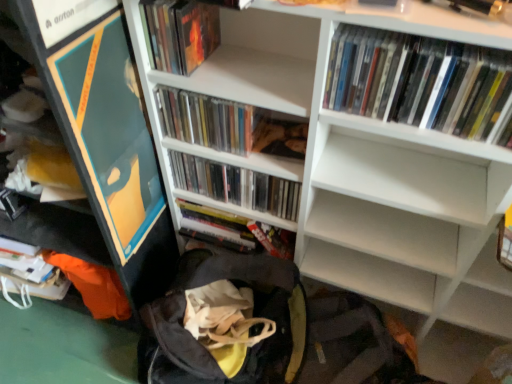
In order to click on free point above white glossy dvds at upper right, the first book from the front (from a real-world perspective) in this screenshot , I will do `click(437, 49)`.